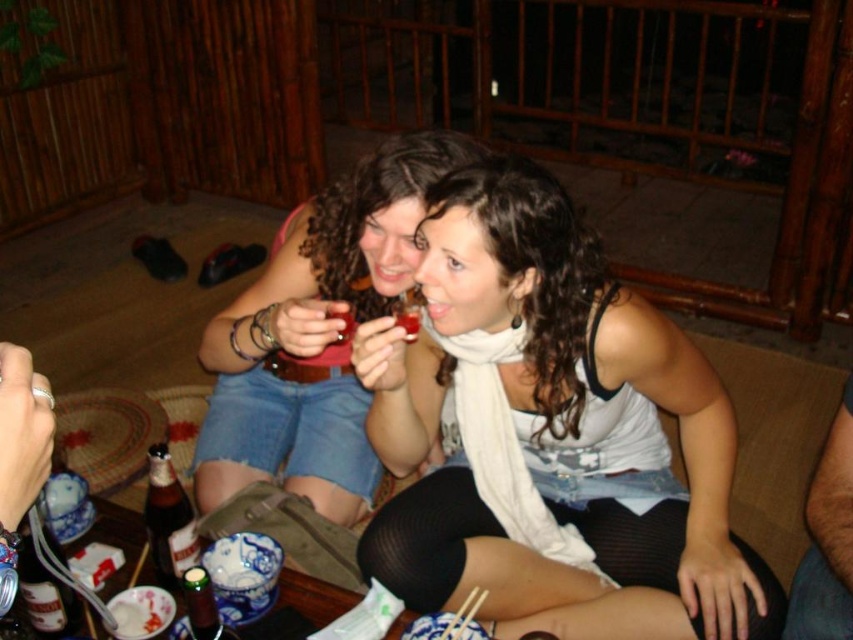
Is white matte scarf at center above translucent glass cup at center?

Result: No, white matte scarf at center is not above translucent glass cup at center.

Which of these two, white matte scarf at center or translucent glass cup at center, stands shorter?

translucent glass cup at center is shorter.

Does point (370, 560) come behind point (346, 332)?

No, (370, 560) is closer to viewer.

Image resolution: width=853 pixels, height=640 pixels. What are the coordinates of `white matte scarf at center` in the screenshot? It's located at (572, 436).

Which is more to the left, dark blue jeans at lower right or matte plastic cup at center?

matte plastic cup at center

Who is more distant from viewer, (821, 560) or (404, 326)?

The point (821, 560) is behind.

Where is `dark blue jeans at lower right`? dark blue jeans at lower right is located at coordinates (827, 541).

At what (x,y) coordinates should I click in order to perform the action: click on dark blue jeans at lower right. Please return your answer as a coordinate pair (x, y). Looking at the image, I should click on (827, 541).

Between green matte bottle at lower left and matte plastic cup at center, which one is positioned lower?

Positioned lower is green matte bottle at lower left.

Which is more to the right, green matte bottle at lower left or matte plastic cup at center?

From the viewer's perspective, matte plastic cup at center appears more on the right side.

Which is in front, point (189, 588) or point (409, 340)?

Positioned in front is point (189, 588).

This screenshot has height=640, width=853. In order to click on green matte bottle at lower left in this screenshot , I will do `click(200, 604)`.